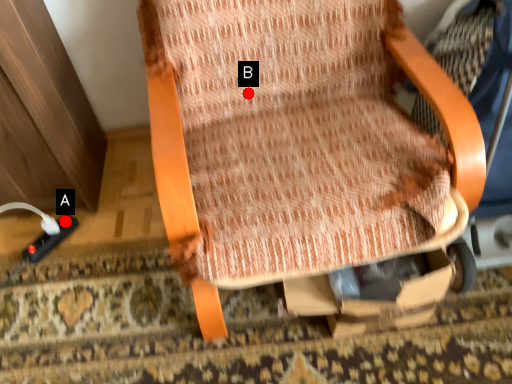
Question: Two points are circled on the image, labeled by A and B beside each circle. Which point is closer to the camera taking this photo?

Choices:
 (A) A is closer
 (B) B is closer

Answer: (B)